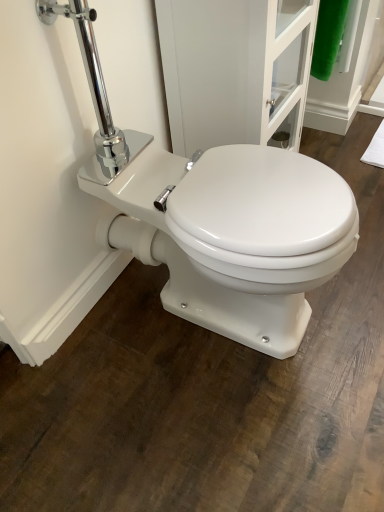
Find the location of `free location in front of white glossy toilet at center`. free location in front of white glossy toilet at center is located at coordinates (212, 430).